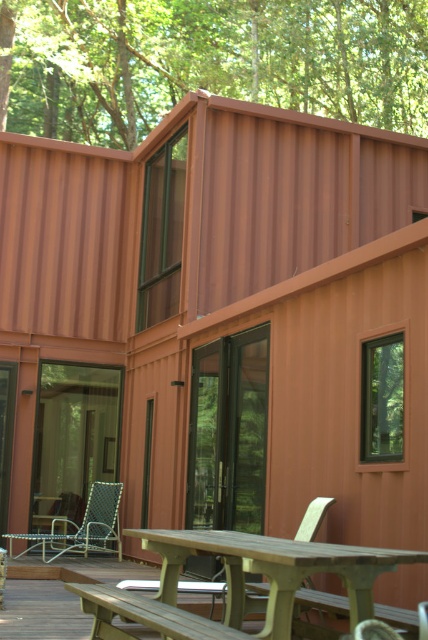
Question: Which point is closer to the camera?

Choices:
 (A) wooden bench at lower center
 (B) light brown wooden table at center

Answer: (B)

Question: Among these points, which one is nearest to the camera?

Choices:
 (A) (356, 609)
 (B) (171, 624)

Answer: (B)

Question: Can you confirm if light brown wooden table at center is positioned to the left of wooden bench at lower center?

Choices:
 (A) yes
 (B) no

Answer: (B)

Question: Does light brown wooden table at center appear over wooden bench at lower center?

Choices:
 (A) no
 (B) yes

Answer: (B)

Question: Where is light brown wooden table at center located in relation to wooden bench at lower center in the image?

Choices:
 (A) above
 (B) below

Answer: (A)